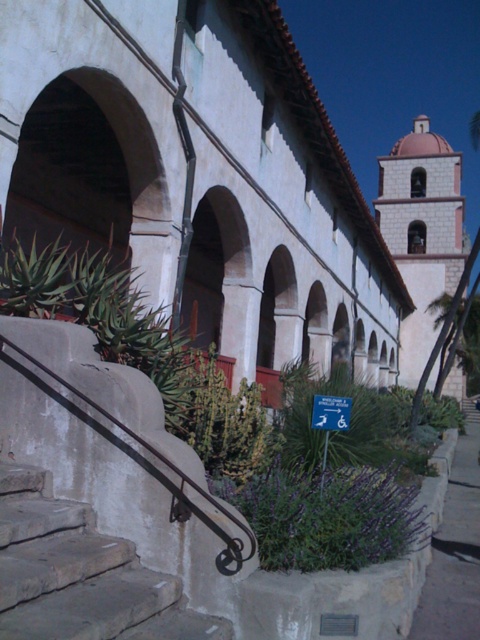
Question: Which of the following is the closest to the observer?

Choices:
 (A) concrete stairs at lower left
 (B) purple leafy plant at lower center
 (C) rusty metal handrail at lower left

Answer: (A)

Question: Does purple leafy plant at lower center lie behind white stucco church at upper right?

Choices:
 (A) no
 (B) yes

Answer: (A)

Question: Does white stucco church at center have a greater width compared to gray concrete pavement at lower right?

Choices:
 (A) no
 (B) yes

Answer: (B)

Question: Which point is farther from the camera taking this photo?

Choices:
 (A) (448, 548)
 (B) (222, 634)
 (C) (223, 554)

Answer: (A)

Question: Which object is the closest to the white stucco church at upper right?

Choices:
 (A) gray concrete pavement at lower right
 (B) concrete stairs at lower left
 (C) white stucco church at center

Answer: (C)

Question: From the image, what is the correct spatial relationship of white stucco church at center in relation to rusty metal handrail at lower left?

Choices:
 (A) above
 (B) below

Answer: (A)